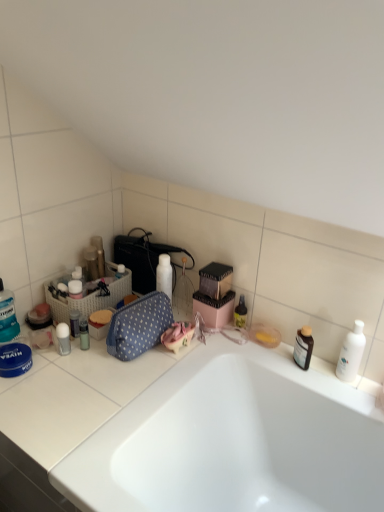
The height and width of the screenshot is (512, 384). In order to click on space that is in front of blue polka dot fabric bag at center in this screenshot , I will do `click(124, 377)`.